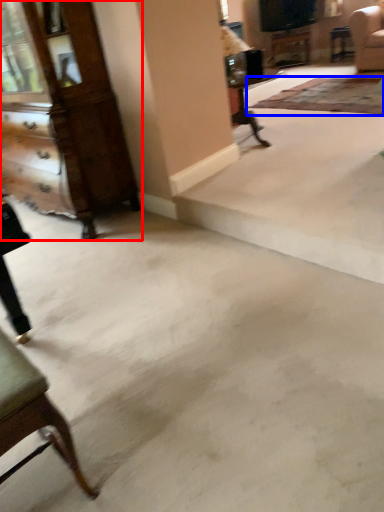
Question: Which object is further to the camera taking this photo, dresser (highlighted by a red box) or mat (highlighted by a blue box)?

Choices:
 (A) dresser
 (B) mat

Answer: (B)